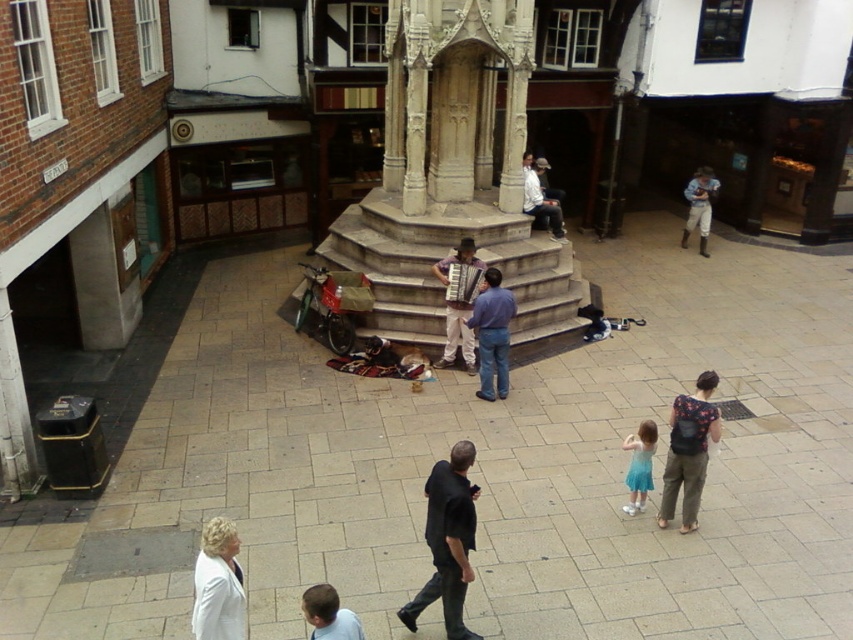
Is white fabric jacket at lower left positioned at the back of blue jeans at center?

No, it is in front of blue jeans at center.

Which is behind, point (238, 611) or point (480, 360)?

Point (480, 360)

Between point (204, 625) and point (505, 316), which one is positioned in front?

Positioned in front is point (204, 625).

This screenshot has height=640, width=853. Identify the location of white fabric jacket at lower left. (218, 584).

Between point (329, 634) and point (653, 445), which one is positioned behind?

Positioned behind is point (653, 445).

Which is below, light blue shirt at lower center or light blue tulle skirt at lower center?

Positioned lower is light blue shirt at lower center.

Is point (311, 588) closer to camera compared to point (630, 444)?

Yes, point (311, 588) is in front of point (630, 444).

At what (x,y) coordinates should I click in order to perform the action: click on light blue shirt at lower center. Please return your answer as a coordinate pair (x, y). The height and width of the screenshot is (640, 853). Looking at the image, I should click on (328, 614).

Is point (665, 474) closer to camera compared to point (526, 168)?

Yes, it is in front of point (526, 168).

Between point (692, 476) and point (523, 202), which one is positioned in front?

Point (692, 476)

The image size is (853, 640). Identify the location of dark floral shirt at lower right. (688, 451).